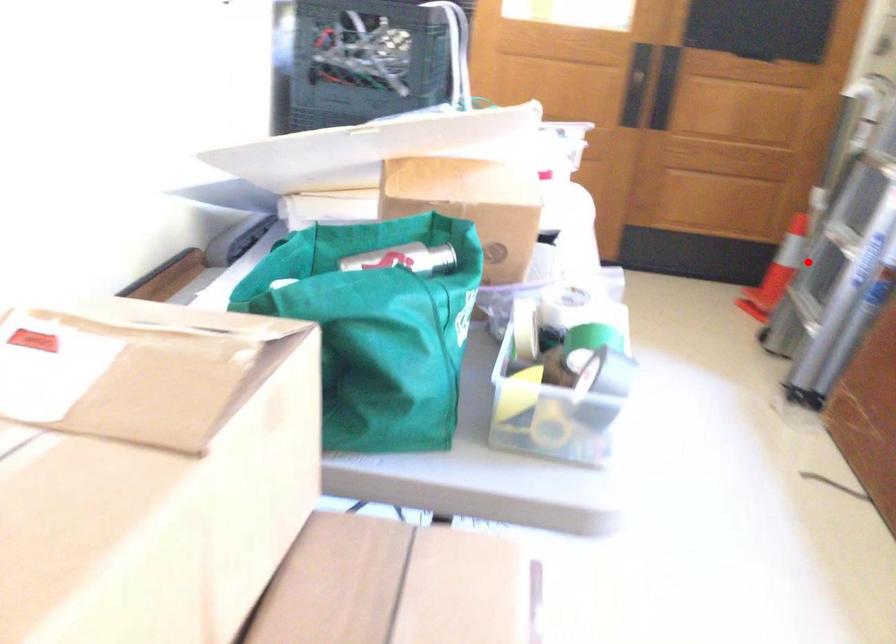
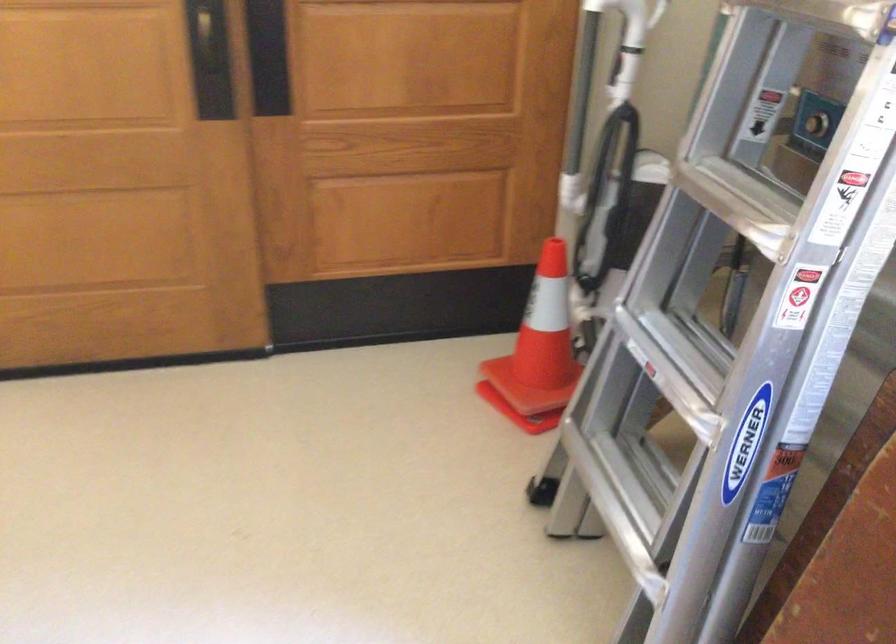
Question: I am providing you with two images of the same scene from different viewpoints. Image1 has a red point marked. In image2, the corresponding 3D location appears at what relative position? Reply with the corresponding letter.

Choices:
 (A) Closer
 (B) Farther

Answer: (A)